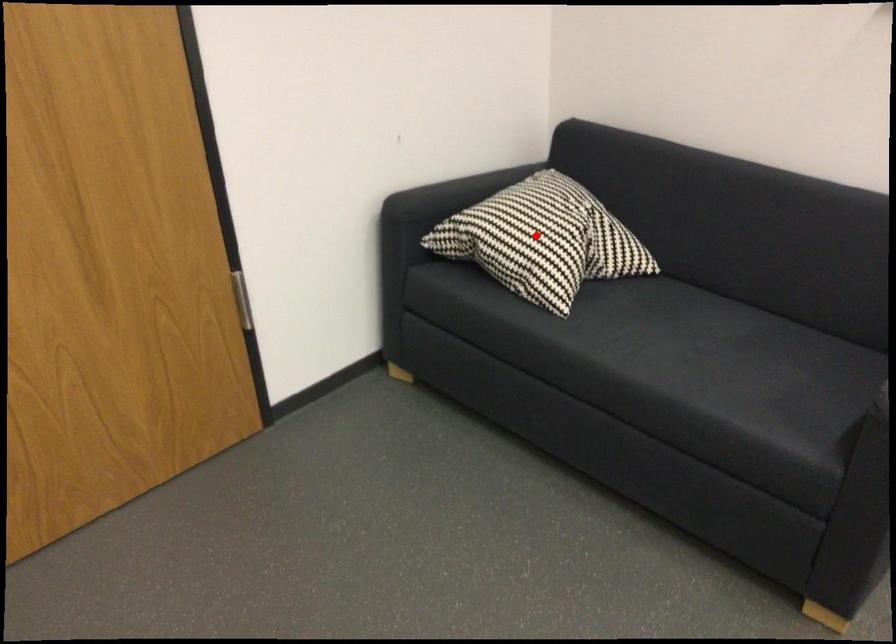
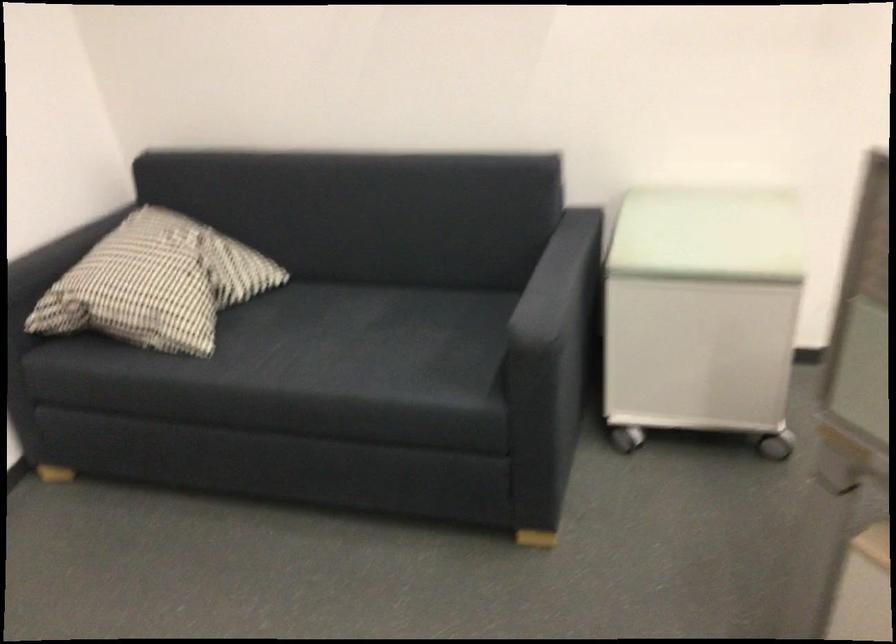
The point at the highlighted location is marked in the first image. Where is the corresponding point in the second image?

(156, 283)